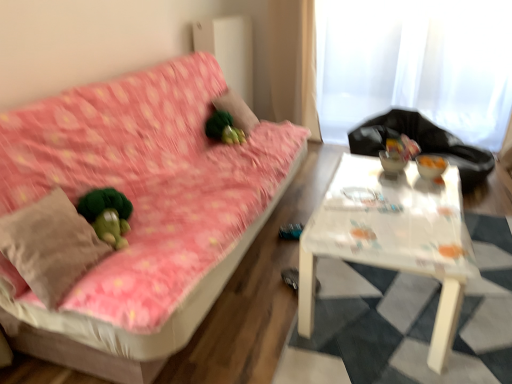
Question: From the image's perspective, does beige cotton throw pillow at left appear lower than white sheer curtain at upper right?

Choices:
 (A) no
 (B) yes

Answer: (B)

Question: Could you tell me if beige cotton throw pillow at left is turned towards white sheer curtain at upper right?

Choices:
 (A) no
 (B) yes

Answer: (A)

Question: From a real-world perspective, is beige cotton throw pillow at left positioned over white sheer curtain at upper right based on gravity?

Choices:
 (A) no
 (B) yes

Answer: (A)

Question: Is beige cotton throw pillow at left in contact with white sheer curtain at upper right?

Choices:
 (A) no
 (B) yes

Answer: (A)

Question: Is beige cotton throw pillow at left facing away from white sheer curtain at upper right?

Choices:
 (A) yes
 (B) no

Answer: (B)

Question: From a real-world perspective, is white plastic table at center above or below green fuzzy ball at center?

Choices:
 (A) below
 (B) above

Answer: (A)

Question: In terms of height, does white plastic table at center look taller or shorter compared to green fuzzy ball at center?

Choices:
 (A) short
 (B) tall

Answer: (B)

Question: Visually, is white plastic table at center positioned to the left or to the right of green fuzzy ball at center?

Choices:
 (A) left
 (B) right

Answer: (B)

Question: In terms of width, does white plastic table at center look wider or thinner when compared to green fuzzy ball at center?

Choices:
 (A) wide
 (B) thin

Answer: (A)

Question: Visually, is black plastic bag at upper right positioned to the left or to the right of white plastic table at center?

Choices:
 (A) right
 (B) left

Answer: (A)

Question: From their relative heights in the image, would you say black plastic bag at upper right is taller or shorter than white plastic table at center?

Choices:
 (A) tall
 (B) short

Answer: (A)

Question: In terms of width, does black plastic bag at upper right look wider or thinner when compared to white plastic table at center?

Choices:
 (A) wide
 (B) thin

Answer: (A)

Question: Does point (478, 163) appear closer or farther from the camera than point (347, 218)?

Choices:
 (A) farther
 (B) closer

Answer: (A)

Question: Is point (387, 57) closer or farther from the camera than point (52, 301)?

Choices:
 (A) farther
 (B) closer

Answer: (A)

Question: Looking at the image, does white sheer curtain at upper right seem bigger or smaller compared to beige cotton throw pillow at left?

Choices:
 (A) big
 (B) small

Answer: (A)